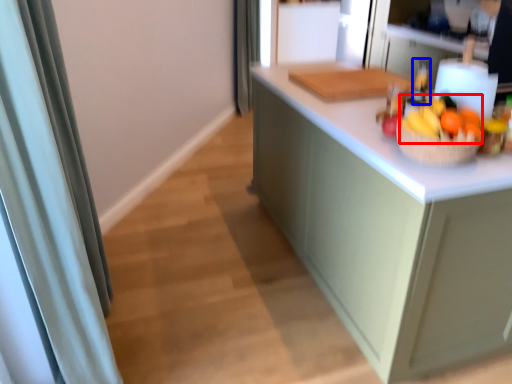
Question: Which object appears farthest to the camera in this image, fruit (highlighted by a red box) or bottle (highlighted by a blue box)?

Choices:
 (A) fruit
 (B) bottle

Answer: (B)